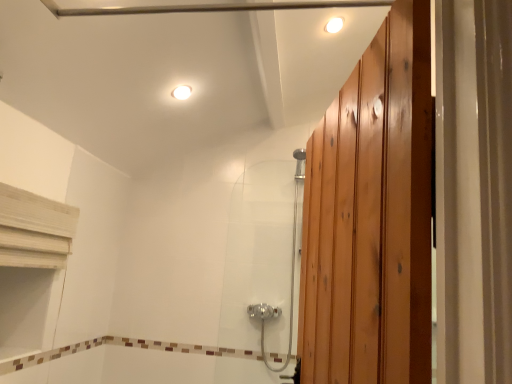
Question: From the image's perspective, is white glossy light fixture at upper center, which is counted as the 1th light fixture, starting from the left, located beneath white glossy light fixture at upper center, the 2th light fixture in the bottom-to-top sequence?

Choices:
 (A) no
 (B) yes

Answer: (B)

Question: Is white glossy light fixture at upper center, placed as the 1th light fixture when sorted from bottom to top, taller than white glossy light fixture at upper center, placed as the second light fixture when sorted from left to right?

Choices:
 (A) no
 (B) yes

Answer: (B)

Question: Can you confirm if white glossy light fixture at upper center, placed as the 1th light fixture when sorted from bottom to top, is smaller than white glossy light fixture at upper center, marked as the first light fixture in a top-to-bottom arrangement?

Choices:
 (A) yes
 (B) no

Answer: (B)

Question: Does white glossy light fixture at upper center, positioned as the 2th light fixture in right-to-left order, lie in front of white glossy light fixture at upper center, marked as the first light fixture in a top-to-bottom arrangement?

Choices:
 (A) yes
 (B) no

Answer: (B)

Question: Is white glossy light fixture at upper center, placed as the 1th light fixture when sorted from bottom to top, wider than white glossy light fixture at upper center, marked as the first light fixture in a top-to-bottom arrangement?

Choices:
 (A) yes
 (B) no

Answer: (A)

Question: Would you say white glossy light fixture at upper center, placed as the 1th light fixture when sorted from bottom to top, is inside or outside satin chrome shower door at center?

Choices:
 (A) inside
 (B) outside

Answer: (B)

Question: From the image's perspective, is white glossy light fixture at upper center, placed as the 1th light fixture when sorted from bottom to top, positioned above or below satin chrome shower door at center?

Choices:
 (A) below
 (B) above

Answer: (B)

Question: Is white glossy light fixture at upper center, placed as the 1th light fixture when sorted from bottom to top, wider or thinner than satin chrome shower door at center?

Choices:
 (A) thin
 (B) wide

Answer: (A)

Question: Relative to satin chrome shower door at center, is white glossy light fixture at upper center, which is counted as the 1th light fixture, starting from the left, in front or behind?

Choices:
 (A) front
 (B) behind

Answer: (A)

Question: Visually, is white glossy light fixture at upper center, marked as the first light fixture in a top-to-bottom arrangement, positioned to the left or to the right of white glossy light fixture at upper center, which ranks as the second light fixture in top-to-bottom order?

Choices:
 (A) right
 (B) left

Answer: (A)

Question: Looking at the image, does white glossy light fixture at upper center, marked as the first light fixture in a top-to-bottom arrangement, seem bigger or smaller compared to white glossy light fixture at upper center, which ranks as the second light fixture in top-to-bottom order?

Choices:
 (A) big
 (B) small

Answer: (B)

Question: Is white glossy light fixture at upper center, marked as the first light fixture in a top-to-bottom arrangement, taller or shorter than white glossy light fixture at upper center, placed as the 1th light fixture when sorted from bottom to top?

Choices:
 (A) short
 (B) tall

Answer: (A)

Question: Is white glossy light fixture at upper center, the 2th light fixture in the bottom-to-top sequence, situated inside white glossy light fixture at upper center, placed as the 1th light fixture when sorted from bottom to top, or outside?

Choices:
 (A) outside
 (B) inside

Answer: (A)

Question: Relative to white glossy light fixture at upper center, positioned as the 2th light fixture in right-to-left order, is satin chrome shower door at center in front or behind?

Choices:
 (A) behind
 (B) front

Answer: (A)

Question: Looking at the image, does satin chrome shower door at center seem bigger or smaller compared to white glossy light fixture at upper center, positioned as the 2th light fixture in right-to-left order?

Choices:
 (A) small
 (B) big

Answer: (B)